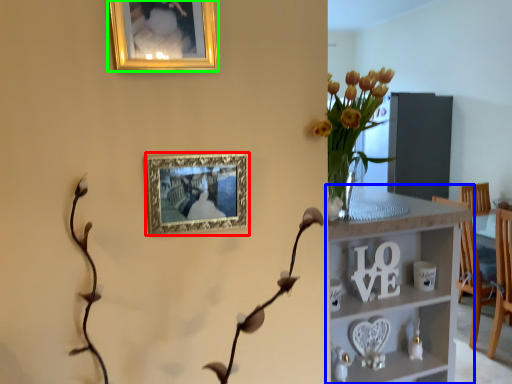
Question: Estimate the real-world distances between objects in this image. Which object is closer to picture frame (highlighted by a red box), shelf (highlighted by a blue box) or picture frame (highlighted by a green box)?

Choices:
 (A) shelf
 (B) picture frame

Answer: (B)